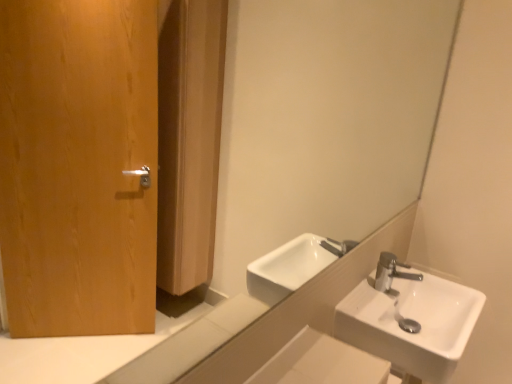
Where is `white ceramic sink at right`? This screenshot has width=512, height=384. white ceramic sink at right is located at coordinates (417, 322).

What do you see at coordinates (417, 322) in the screenshot? The image size is (512, 384). I see `white ceramic sink at right` at bounding box center [417, 322].

Describe the element at coordinates (312, 137) in the screenshot. I see `white glossy mirror at upper center` at that location.

Locate an element on the screen. The height and width of the screenshot is (384, 512). white glossy mirror at upper center is located at coordinates (312, 137).

At what (x,y) coordinates should I click in order to perform the action: click on white ceramic sink at right. Please return your answer as a coordinate pair (x, y). This screenshot has height=384, width=512. Looking at the image, I should click on (417, 322).

Between white ceramic sink at right and white glossy mirror at upper center, which one appears on the left side from the viewer's perspective?

white glossy mirror at upper center.

In the image, is white ceramic sink at right positioned in front of or behind white glossy mirror at upper center?

white ceramic sink at right is behind white glossy mirror at upper center.

Considering the points (471, 326) and (276, 114), which point is in front, point (471, 326) or point (276, 114)?

Positioned in front is point (471, 326).

From the image's perspective, would you say white ceramic sink at right is shown under white glossy mirror at upper center?

Yes, from the image's perspective, white ceramic sink at right is beneath white glossy mirror at upper center.

From a real-world perspective, is white ceramic sink at right positioned above or below white glossy mirror at upper center?

white ceramic sink at right is situated lower than white glossy mirror at upper center in the real world.

Considering the relative sizes of white ceramic sink at right and white glossy mirror at upper center in the image provided, is white ceramic sink at right wider than white glossy mirror at upper center?

Correct, the width of white ceramic sink at right exceeds that of white glossy mirror at upper center.

Between white ceramic sink at right and white glossy mirror at upper center, which one has less height?

With less height is white ceramic sink at right.

Can you confirm if white ceramic sink at right is smaller than white glossy mirror at upper center?

Yes, white ceramic sink at right is smaller than white glossy mirror at upper center.

Is white glossy mirror at upper center a part of white ceramic sink at right?

No, white ceramic sink at right does not contain white glossy mirror at upper center.

Is there a large distance between white ceramic sink at right and white glossy mirror at upper center?

That's not correct — white ceramic sink at right is a little close to white glossy mirror at upper center.

Is white glossy mirror at upper center at the back of white ceramic sink at right?

No, white ceramic sink at right is not facing the opposite direction of white glossy mirror at upper center.

Can you tell me how much white ceramic sink at right and white glossy mirror at upper center differ in facing direction?

0.364 degrees.

How distant is white ceramic sink at right from white glossy mirror at upper center?

A distance of 31.89 inches exists between white ceramic sink at right and white glossy mirror at upper center.

The image size is (512, 384). Identify the location of sink below the white glossy mirror at upper center (from the image's perspective). (417, 322).

In the image, is white glossy mirror at upper center on the left side or the right side of white ceramic sink at right?

white glossy mirror at upper center is positioned on white ceramic sink at right's left side.

Between white glossy mirror at upper center and white ceramic sink at right, which one is positioned in front?

white glossy mirror at upper center is in front.

Considering the points (242, 325) and (423, 294), which point is behind, point (242, 325) or point (423, 294)?

The point (423, 294) is farther from the camera.

From the image's perspective, relative to white ceramic sink at right, is white glossy mirror at upper center above or below?

Clearly, from the image's perspective, white glossy mirror at upper center is above white ceramic sink at right.

In the scene shown: From a real-world perspective, is white glossy mirror at upper center physically above white ceramic sink at right?

Correct, in the physical world, white glossy mirror at upper center is higher than white ceramic sink at right.

Is white glossy mirror at upper center thinner than white ceramic sink at right?

Correct, the width of white glossy mirror at upper center is less than that of white ceramic sink at right.

Which of these two, white glossy mirror at upper center or white ceramic sink at right, stands taller?

white glossy mirror at upper center is taller.

Between white glossy mirror at upper center and white ceramic sink at right, which one has larger size?

white glossy mirror at upper center.

Is white glossy mirror at upper center positioned beyond the bounds of white ceramic sink at right?

Absolutely, white glossy mirror at upper center is external to white ceramic sink at right.

Is white glossy mirror at upper center next to white ceramic sink at right and touching it?

white glossy mirror at upper center is not next to white ceramic sink at right, and they're not touching.

Does white glossy mirror at upper center turn towards white ceramic sink at right?

No, white glossy mirror at upper center is not aimed at white ceramic sink at right.

How many degrees apart are the facing directions of white glossy mirror at upper center and white ceramic sink at right?

The angle between the facing direction of white glossy mirror at upper center and the facing direction of white ceramic sink at right is 0.364 degrees.

In the image, there is a white glossy mirror at upper center. Identify the location of sink below it (from a real-world perspective). The height and width of the screenshot is (384, 512). (417, 322).

Identify the location of mirror above the white ceramic sink at right (from the image's perspective). (312, 137).

The height and width of the screenshot is (384, 512). Find the location of `mirror that appears in front of the white ceramic sink at right`. mirror that appears in front of the white ceramic sink at right is located at coordinates (312, 137).